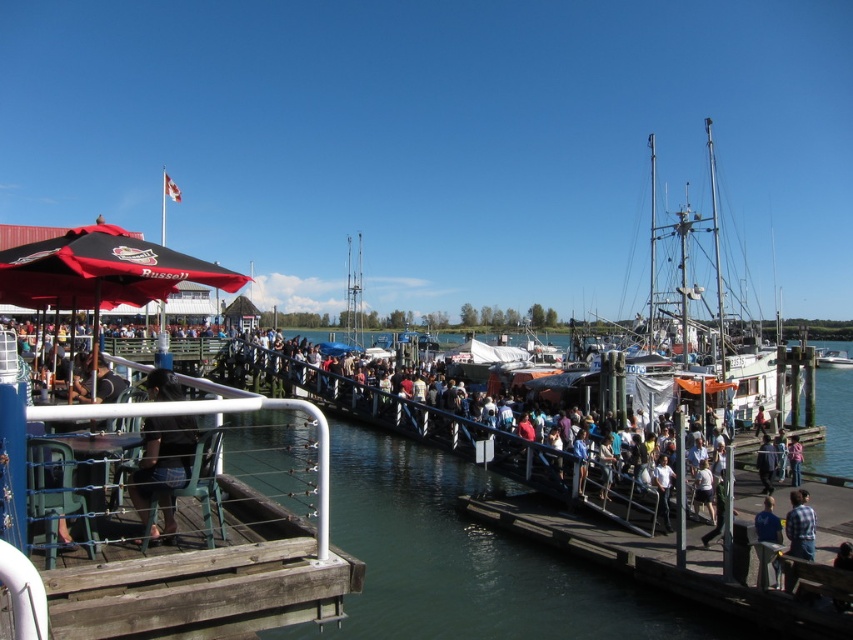
Between point (763, 506) and point (764, 464), which one is positioned in front?

Positioned in front is point (763, 506).

Find the location of a particular element. The image size is (853, 640). blue fabric shirt at lower right is located at coordinates (769, 522).

Locate an element on the screen. The image size is (853, 640). blue fabric shirt at lower right is located at coordinates (769, 522).

Does plaid shirt at lower right have a greater width compared to blue fabric shirt at lower right?

Incorrect, plaid shirt at lower right's width does not surpass blue fabric shirt at lower right's.

Does point (796, 492) come closer to viewer compared to point (769, 534)?

No, (796, 492) is behind (769, 534).

Is point (790, 532) positioned behind point (759, 529)?

No, it is not.

What are the coordinates of `plaid shirt at lower right` in the screenshot? It's located at (799, 525).

Does white wooden boat at right have a greater width compared to blue fabric shirt at center?

Correct, the width of white wooden boat at right exceeds that of blue fabric shirt at center.

Find the location of `white wooden boat at right`. white wooden boat at right is located at coordinates (654, 260).

Describe the element at coordinates (654, 260) in the screenshot. Image resolution: width=853 pixels, height=640 pixels. I see `white wooden boat at right` at that location.

Locate an element on the screen. This screenshot has width=853, height=640. white wooden boat at right is located at coordinates (654, 260).